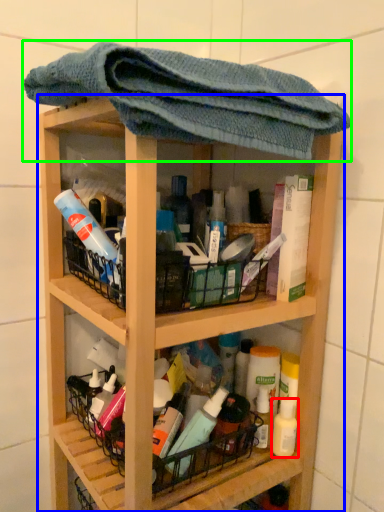
Question: Based on their relative distances, which object is nearer to mouthwash (highlighted by a red box)? Choose from shelf (highlighted by a blue box) and towel (highlighted by a green box).

Choices:
 (A) shelf
 (B) towel

Answer: (A)